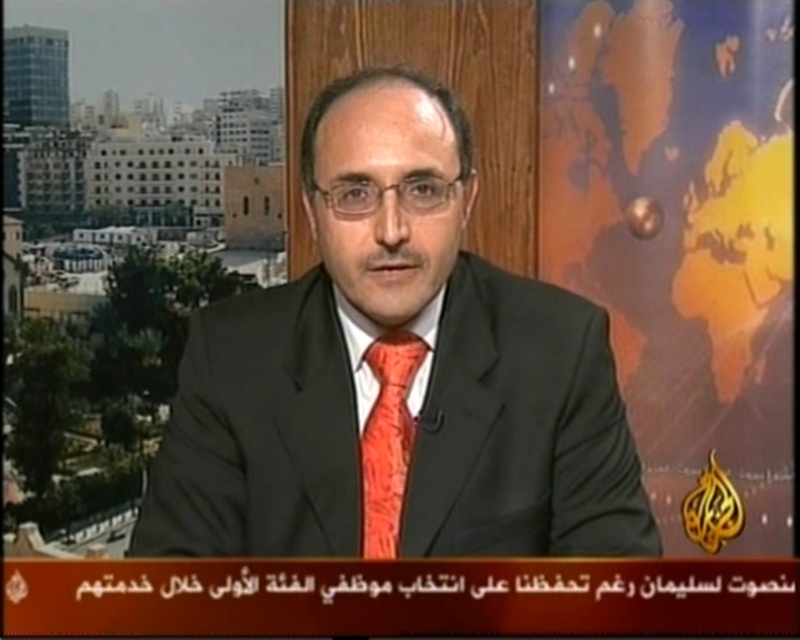
Is orange satin tie at center positioned before matte orange dress shirt at center?

No.

Does orange satin tie at center appear on the right side of matte orange dress shirt at center?

Incorrect, orange satin tie at center is not on the right side of matte orange dress shirt at center.

Identify the location of orange satin tie at center. The width and height of the screenshot is (800, 640). (388, 442).

Which of these two, matte black suit at center or orange satin tie at center, stands taller?

Standing taller between the two is matte black suit at center.

Can you confirm if matte black suit at center is shorter than orange satin tie at center?

No.

Between point (326, 252) and point (388, 376), which one is positioned behind?

Point (388, 376)

What are the coordinates of `matte black suit at center` in the screenshot? It's located at (396, 374).

Can you confirm if matte black suit at center is positioned below matte orange dress shirt at center?

Incorrect, matte black suit at center is not positioned below matte orange dress shirt at center.

Who is taller, matte black suit at center or matte orange dress shirt at center?

matte black suit at center

Find the location of a particular element. The image size is (800, 640). matte black suit at center is located at coordinates (396, 374).